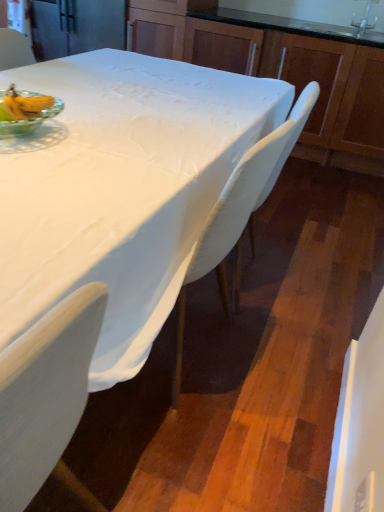
Locate an element on the screen. free space behind green glass bowl at upper left is located at coordinates (85, 111).